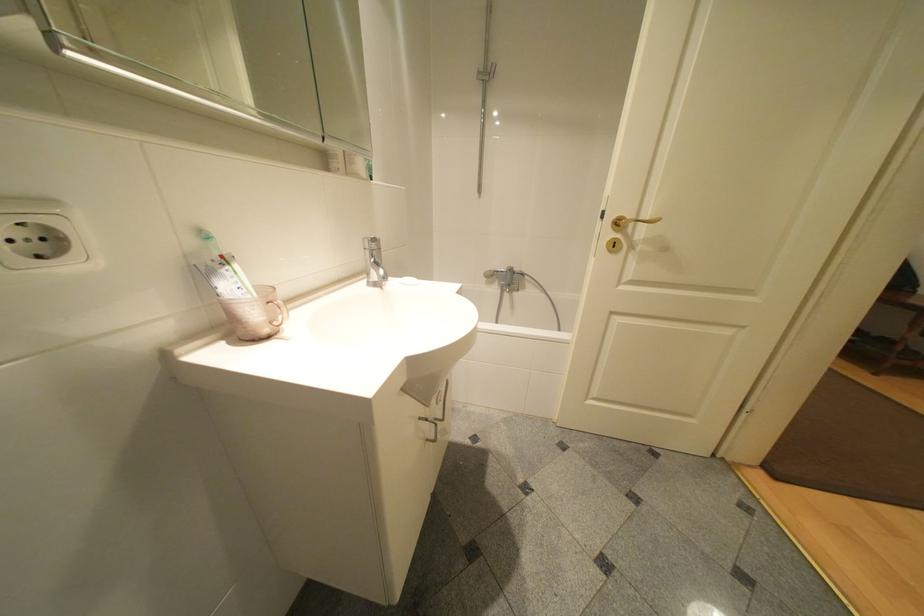
Image resolution: width=924 pixels, height=616 pixels. What do you see at coordinates (51, 33) in the screenshot?
I see `the mirror cabinet handle` at bounding box center [51, 33].